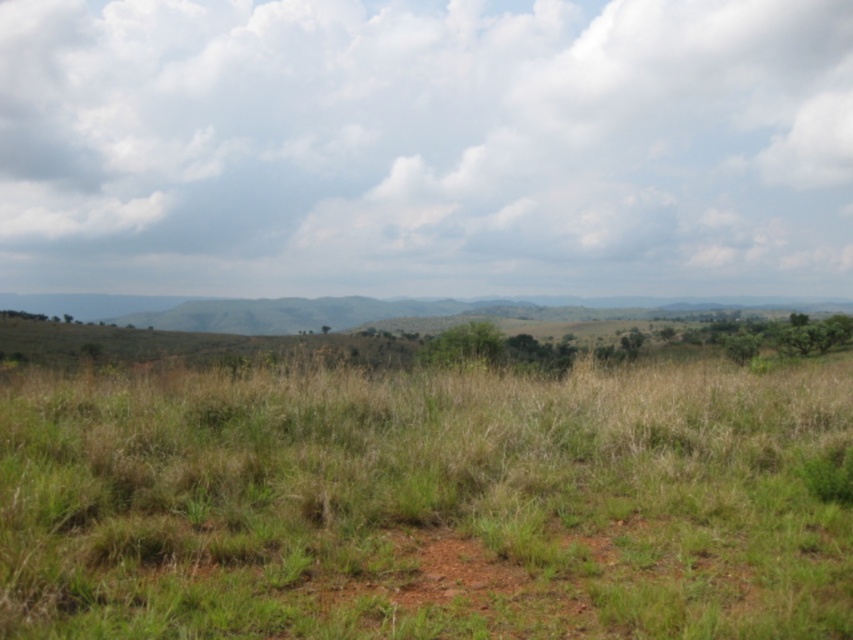
In the scene shown: Can you confirm if white fluffy cloud at upper center is smaller than green grassy at center?

No.

Is point (605, 177) positioned behind point (708, 586)?

Yes, it is behind point (708, 586).

Which is behind, point (569, 10) or point (328, 582)?

The point (569, 10) is more distant.

Image resolution: width=853 pixels, height=640 pixels. In order to click on white fluffy cloud at upper center in this screenshot , I will do `click(425, 147)`.